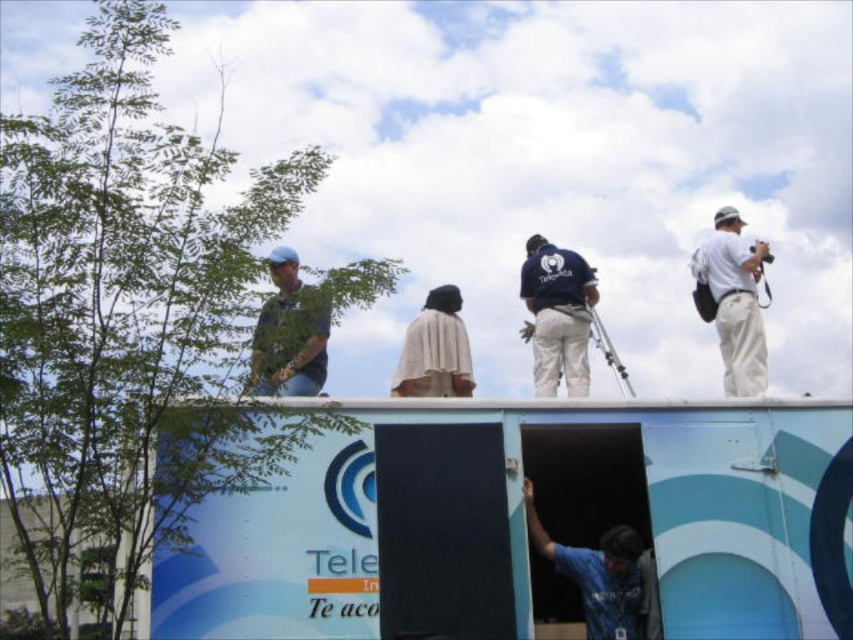
Question: Is blue fabric shirt at lower center to the left of dark blue uniform at center from the viewer's perspective?

Choices:
 (A) yes
 (B) no

Answer: (A)

Question: Can you confirm if dark blue uniform at center is positioned below blue denim jeans at left?

Choices:
 (A) yes
 (B) no

Answer: (B)

Question: Which point is closer to the camera?

Choices:
 (A) (759, 355)
 (B) (643, 561)

Answer: (B)

Question: Which object is positioned closest to the beige fabric shawl at center?

Choices:
 (A) blue denim jeans at left
 (B) white cotton shirt at upper right
 (C) dark blue uniform at center

Answer: (C)

Question: Which is farther from the beige fabric shawl at center?

Choices:
 (A) blue denim jeans at left
 (B) white cotton shirt at upper right
 (C) dark blue uniform at center

Answer: (B)

Question: Is the position of blue denim jeans at left more distant than that of beige fabric shawl at center?

Choices:
 (A) yes
 (B) no

Answer: (B)